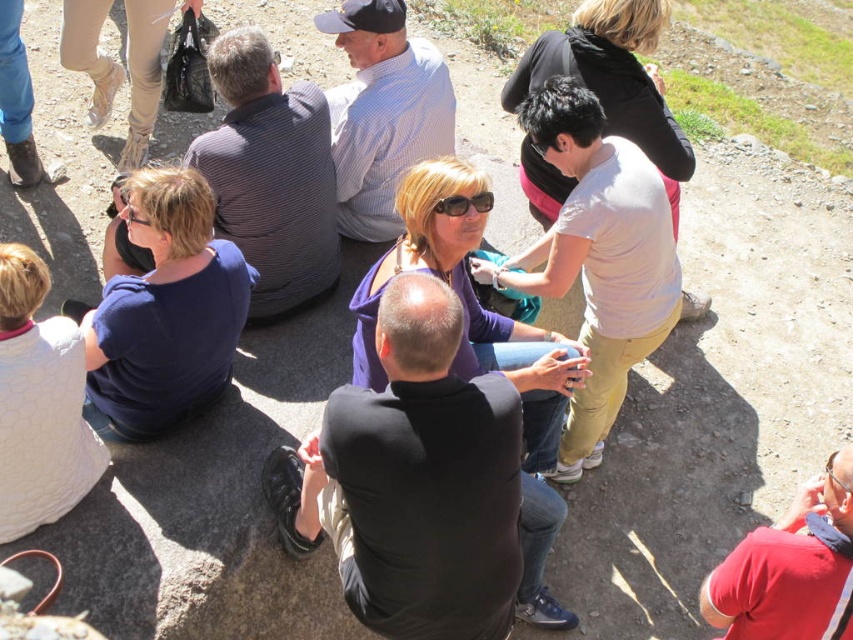
You are a photographer trying to capture a candid shot of the group. You notice the red cotton shirt at lower right and the black plastic sunglasses at center. Which object should you focus on first if you want to ensure both are in sharp focus?

The red cotton shirt at lower right is in front of the black plastic sunglasses at center. To ensure both are in sharp focus, you should focus on the red cotton shirt at lower right first since it is closer to the camera.

Consider the image. You are a photographer standing 10 feet away from the large flat rock where the group is seated. You want to capture a photo that includes both the red cotton shirt at lower right and the black plastic sunglasses at center. Given that your camera has a maximum zoom range of 5 feet, can you adjust your position to ensure both objects are in the frame without moving the subjects?

The red cotton shirt at lower right and black plastic sunglasses at center are 5.44 feet apart. Since your camera can only zoom up to 5 feet, you cannot capture both objects in the same frame without moving closer or adjusting your position because the distance between them exceeds the maximum zoom range.

You are standing at the center of the image and want to locate the red cotton shirt at lower right. In which direction should you look to find it?

The red cotton shirt at lower right is located at the lower right direction from the center of the image.